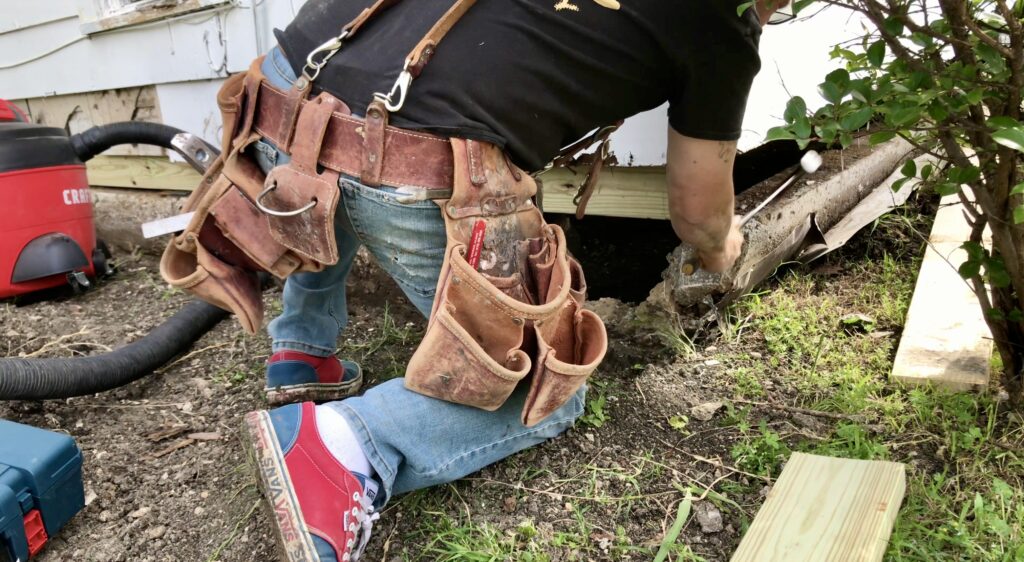
Find the location of a particular element. The width and height of the screenshot is (1024, 562). box is located at coordinates (65, 475).